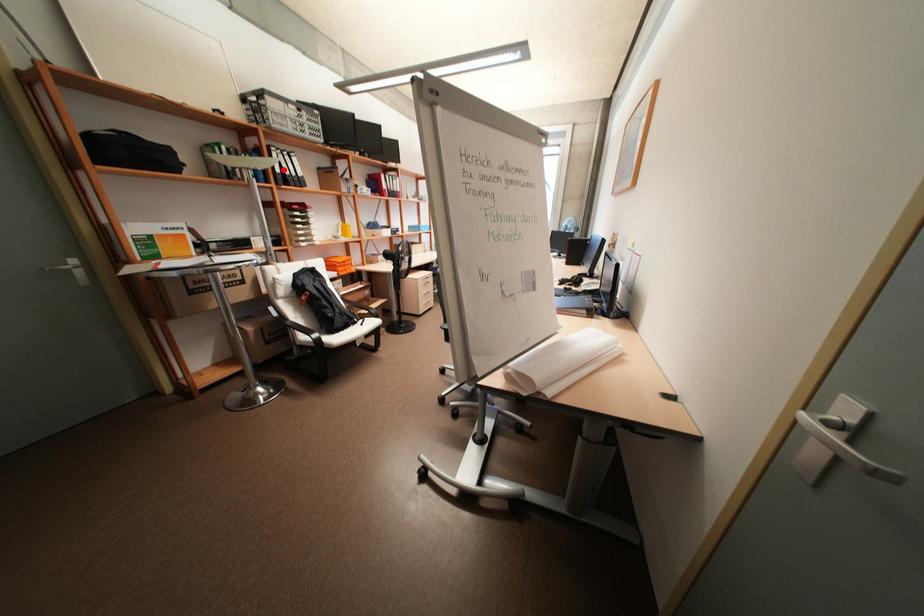
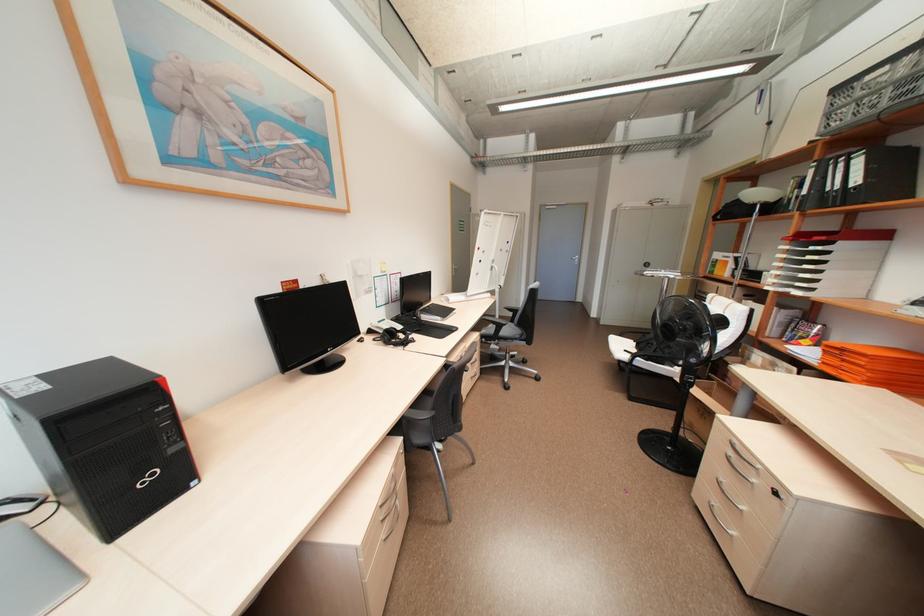
Question: A red point is marked in image1. In image2, is the corresponding 3D point closer to the camera or farther? Reply with the corresponding letter.

Choices:
 (A) The corresponding 3D point is closer.
 (B) The corresponding 3D point is farther.

Answer: (B)